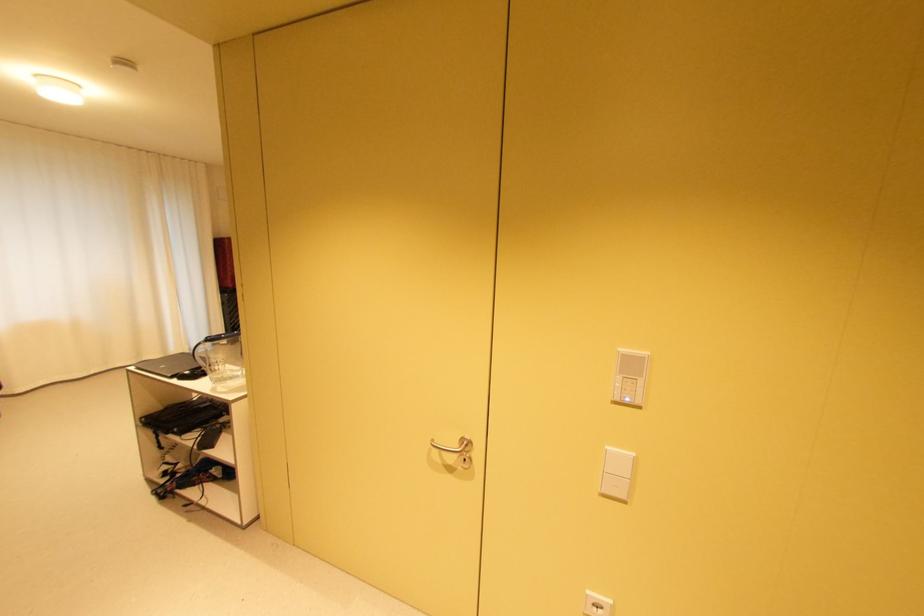
Where would you push the intercom control panel? Please return your answer as a coordinate pair (x, y).

(629, 378)